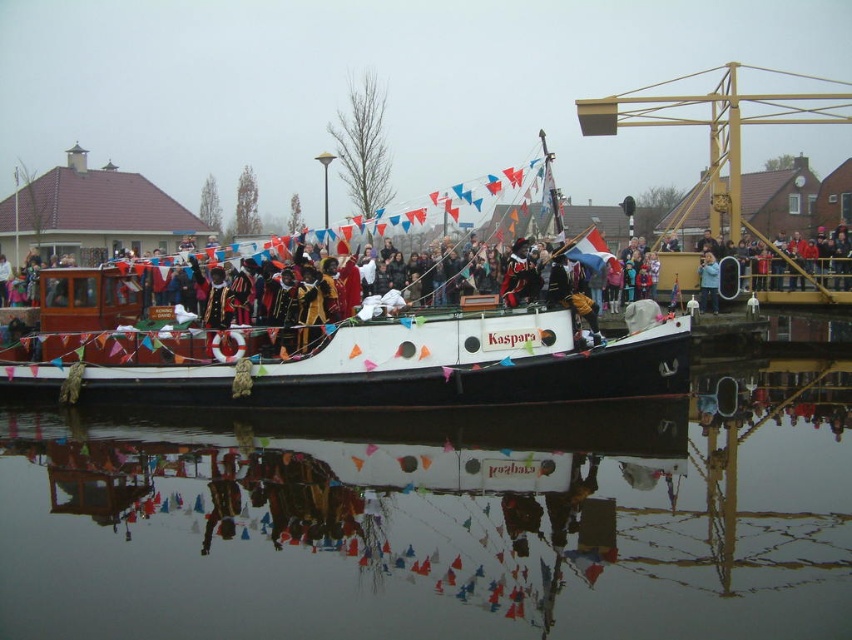
You are a photographer standing on the canal bank. You want to take a photo of the blue fabric jacket at center and the transparent water at center. Which object is positioned to the left of the other?

The transparent water at center is to the left of the blue fabric jacket at center.

You are standing on the dock and see the point marked at coordinates point (332, 353). Which object is this point located on?

The point (332, 353) is located on the white matte boat at center.